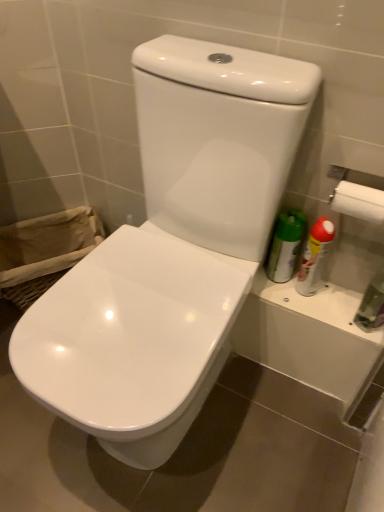
Question: Is transparent plastic bottle at right positioned far away from burlap laundry basket at lower left?

Choices:
 (A) yes
 (B) no

Answer: (B)

Question: Does transparent plastic bottle at right have a lesser width compared to burlap laundry basket at lower left?

Choices:
 (A) no
 (B) yes

Answer: (B)

Question: From a real-world perspective, does transparent plastic bottle at right stand above burlap laundry basket at lower left?

Choices:
 (A) yes
 (B) no

Answer: (A)

Question: Does transparent plastic bottle at right appear on the left side of burlap laundry basket at lower left?

Choices:
 (A) yes
 (B) no

Answer: (B)

Question: Considering the relative sizes of transparent plastic bottle at right and burlap laundry basket at lower left in the image provided, is transparent plastic bottle at right bigger than burlap laundry basket at lower left?

Choices:
 (A) no
 (B) yes

Answer: (A)

Question: Considering their positions, is white glossy toilet at center, the 2th toilet viewed from the right, located in front of or behind transparent plastic bottle at right?

Choices:
 (A) front
 (B) behind

Answer: (A)

Question: In terms of height, does white glossy toilet at center, the 2th toilet viewed from the right, look taller or shorter compared to transparent plastic bottle at right?

Choices:
 (A) tall
 (B) short

Answer: (B)

Question: In terms of width, does white glossy toilet at center, acting as the first toilet starting from the left, look wider or thinner when compared to transparent plastic bottle at right?

Choices:
 (A) wide
 (B) thin

Answer: (A)

Question: Is white glossy toilet at center, acting as the first toilet starting from the left, spatially inside transparent plastic bottle at right, or outside of it?

Choices:
 (A) inside
 (B) outside

Answer: (B)

Question: Is burlap laundry basket at lower left in front of or behind transparent plastic bottle at right in the image?

Choices:
 (A) behind
 (B) front

Answer: (A)

Question: Is burlap laundry basket at lower left inside or outside of transparent plastic bottle at right?

Choices:
 (A) inside
 (B) outside

Answer: (B)

Question: Based on their sizes in the image, would you say burlap laundry basket at lower left is bigger or smaller than transparent plastic bottle at right?

Choices:
 (A) big
 (B) small

Answer: (A)

Question: From the image's perspective, relative to transparent plastic bottle at right, is burlap laundry basket at lower left above or below?

Choices:
 (A) above
 (B) below

Answer: (A)

Question: Based on their positions, is burlap laundry basket at lower left located to the left or right of white glossy toilet at center, the first toilet from the right?

Choices:
 (A) right
 (B) left

Answer: (B)

Question: Is burlap laundry basket at lower left taller or shorter than white glossy toilet at center, placed as the second toilet when sorted from left to right?

Choices:
 (A) tall
 (B) short

Answer: (B)